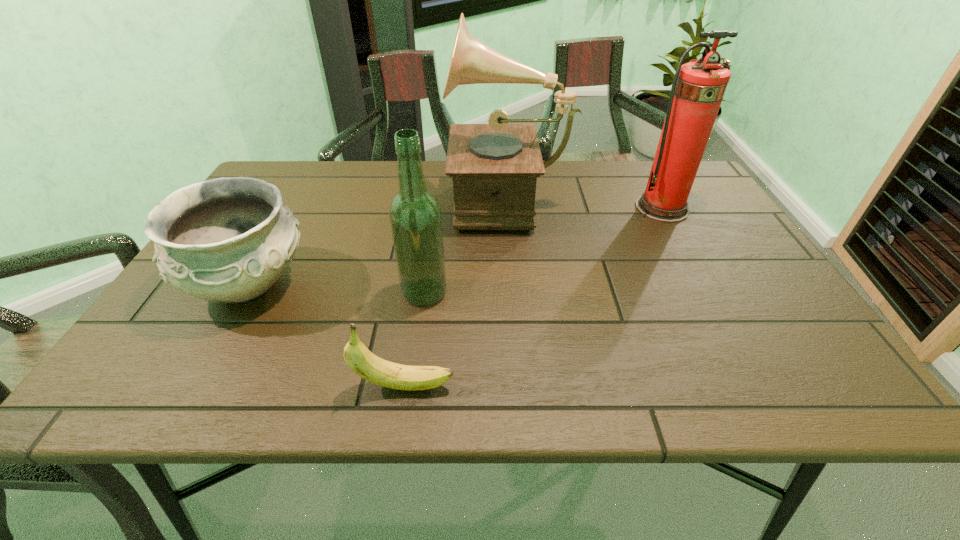
Where is `record player`? record player is located at coordinates (494, 167).

This screenshot has width=960, height=540. I want to click on the rightmost object, so click(x=698, y=88).

You are a GUI agent. You are given a task and a screenshot of the screen. Output one action in this format:
    pyautogui.click(x=<x>, y=<y>)
    Task: Click on the third shortest object
    The height and width of the screenshot is (540, 960).
    Given the screenshot: What is the action you would take?
    pyautogui.click(x=415, y=216)

Where is `the leftmost object`? the leftmost object is located at coordinates (229, 240).

You are a GUI agent. You are given a task and a screenshot of the screen. Output one action in this format:
    pyautogui.click(x=<x>, y=<y>)
    Task: Click on the pottery
    This screenshot has width=960, height=540.
    Given the screenshot: What is the action you would take?
    pyautogui.click(x=229, y=240)

At what (x,y) coordinates should I click in order to perform the action: click on banana. Please return your answer as a coordinate pair (x, y). The width and height of the screenshot is (960, 540). Looking at the image, I should click on (364, 363).

Find the location of a particular element. This screenshot has height=540, width=960. the nearest object is located at coordinates (364, 363).

Identify the location of blank area located on the horn of the record player. (337, 197).

The width and height of the screenshot is (960, 540). Identify the location of vacant space located 0.090m on the horn of the record player. (419, 197).

Find the location of `vacant space located on the horn of the record player`. vacant space located on the horn of the record player is located at coordinates (375, 197).